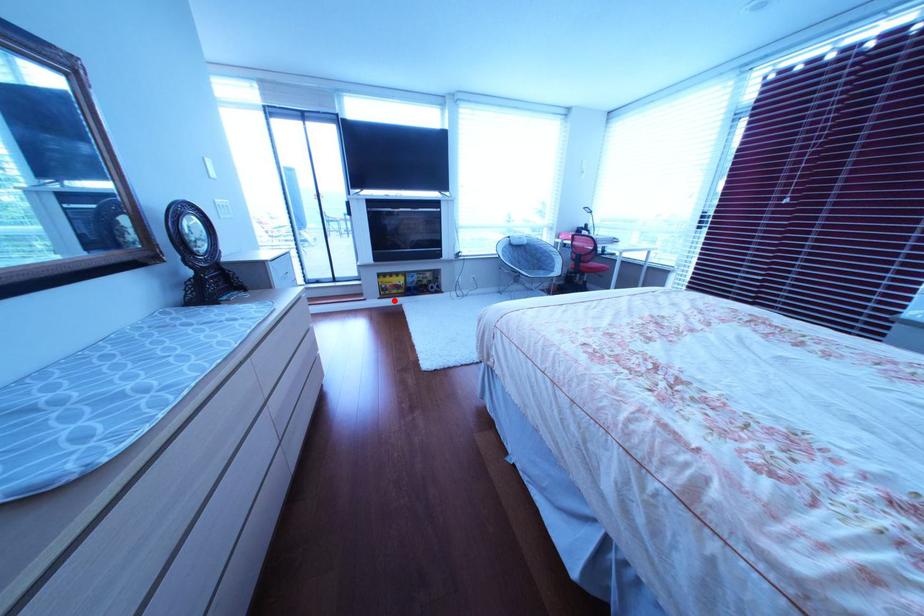
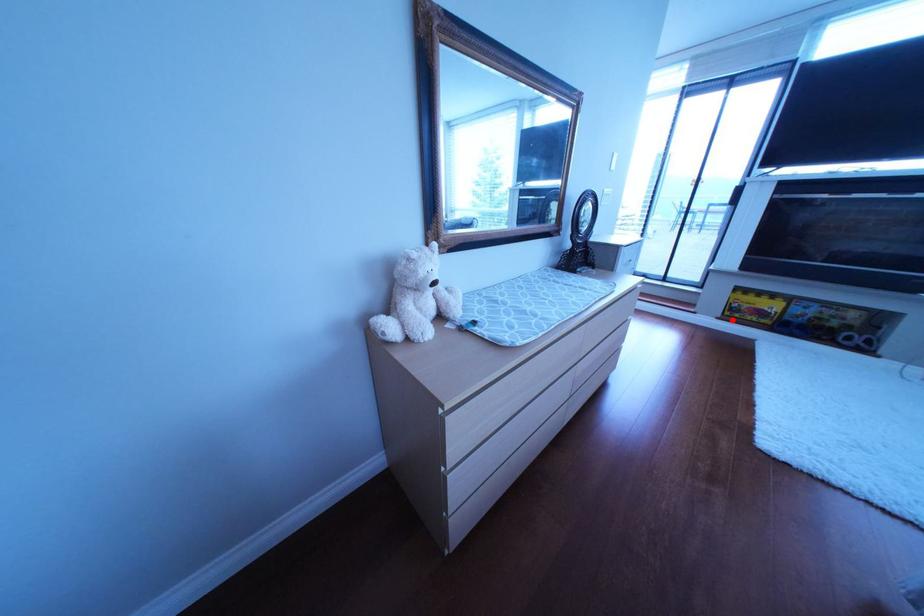
I am providing you with two images of the same scene from different viewpoints. A red point is marked on the first image and another point is marked on the second image. Does the point marked in image1 correspond to the same location as the one in image2?

Yes